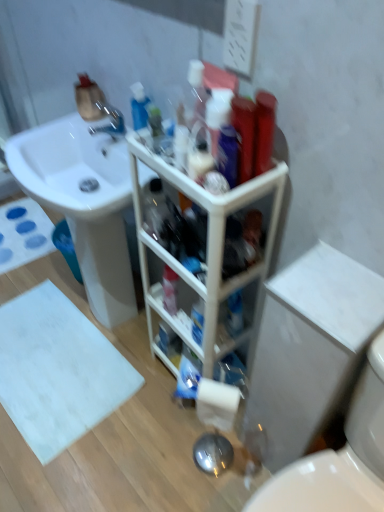
Question: From a real-world perspective, is white matte bath mat at lower left, which is the first bath mat from top to bottom, under white matte toilet paper at lower center?

Choices:
 (A) no
 (B) yes

Answer: (B)

Question: Is white matte toilet paper at lower center inside white matte bath mat at lower left, which is the 1th bath mat in back-to-front order?

Choices:
 (A) yes
 (B) no

Answer: (B)

Question: Is white matte bath mat at lower left, which appears as the second bath mat when viewed from the front, oriented towards white matte toilet paper at lower center?

Choices:
 (A) no
 (B) yes

Answer: (A)

Question: Can you confirm if white matte bath mat at lower left, acting as the second bath mat starting from the bottom, is bigger than white matte toilet paper at lower center?

Choices:
 (A) no
 (B) yes

Answer: (B)

Question: Is white matte bath mat at lower left, which appears as the second bath mat when viewed from the front, far from white matte toilet paper at lower center?

Choices:
 (A) no
 (B) yes

Answer: (B)

Question: Considering the positions of white matte bath mat at lower left, positioned as the 2th bath mat in top-to-bottom order, and white glossy sink at upper left in the image, is white matte bath mat at lower left, positioned as the 2th bath mat in top-to-bottom order, wider or thinner than white glossy sink at upper left?

Choices:
 (A) thin
 (B) wide

Answer: (B)

Question: Is point (76, 330) closer or farther from the camera than point (129, 262)?

Choices:
 (A) farther
 (B) closer

Answer: (A)

Question: From the image's perspective, is white matte bath mat at lower left, positioned as the 2th bath mat in top-to-bottom order, located above or below white glossy sink at upper left?

Choices:
 (A) above
 (B) below

Answer: (B)

Question: Visually, is white matte bath mat at lower left, which is the 1th bath mat in bottom-to-top order, positioned to the left or to the right of white glossy sink at upper left?

Choices:
 (A) left
 (B) right

Answer: (A)

Question: In the image, is white matte bath mat at lower left, the 1th bath mat viewed from the front, positioned in front of or behind white glossy toilet at lower right?

Choices:
 (A) behind
 (B) front

Answer: (A)

Question: Considering the positions of white matte bath mat at lower left, the 1th bath mat viewed from the front, and white glossy toilet at lower right in the image, is white matte bath mat at lower left, the 1th bath mat viewed from the front, bigger or smaller than white glossy toilet at lower right?

Choices:
 (A) big
 (B) small

Answer: (B)

Question: Considering the positions of white matte bath mat at lower left, the second bath mat from the back, and white glossy toilet at lower right in the image, is white matte bath mat at lower left, the second bath mat from the back, wider or thinner than white glossy toilet at lower right?

Choices:
 (A) wide
 (B) thin

Answer: (B)

Question: From their relative heights in the image, would you say white matte bath mat at lower left, which is the 1th bath mat in bottom-to-top order, is taller or shorter than white glossy toilet at lower right?

Choices:
 (A) tall
 (B) short

Answer: (B)

Question: In the image, is metallic silver faucet at upper left positioned in front of or behind white glossy toilet at lower right?

Choices:
 (A) front
 (B) behind

Answer: (B)

Question: Considering the positions of metallic silver faucet at upper left and white glossy toilet at lower right in the image, is metallic silver faucet at upper left bigger or smaller than white glossy toilet at lower right?

Choices:
 (A) big
 (B) small

Answer: (B)